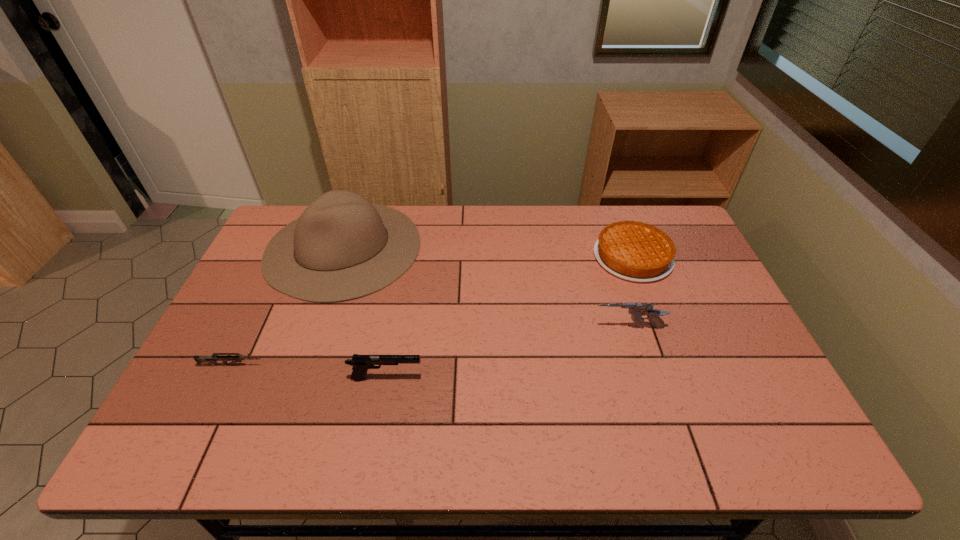
Where is `gun that stands as the closest to the second gun from right to left`? The height and width of the screenshot is (540, 960). gun that stands as the closest to the second gun from right to left is located at coordinates (213, 359).